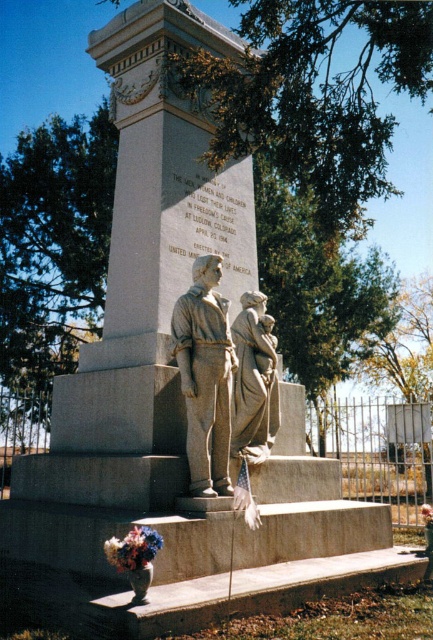
Question: Which point is farther from the camera taking this photo?

Choices:
 (A) (115, 550)
 (B) (426, 506)

Answer: (B)

Question: Considering the relative positions of matte gray stone sculpture at center and fluffy bouquet at lower center in the image provided, where is matte gray stone sculpture at center located with respect to fluffy bouquet at lower center?

Choices:
 (A) left
 (B) right

Answer: (A)

Question: Is matte gray stone sculpture at center to the left of fluffy bouquet at lower center from the viewer's perspective?

Choices:
 (A) no
 (B) yes

Answer: (B)

Question: Which of these objects is positioned farthest from the gray stone statue at center?

Choices:
 (A) matte gray stone sculpture at center
 (B) fluffy bouquet at lower center

Answer: (B)

Question: In this image, where is fluffy bouquet at lower left located relative to fluffy bouquet at lower center?

Choices:
 (A) right
 (B) left

Answer: (B)

Question: Which of the following is the closest to the observer?

Choices:
 (A) (216, 340)
 (B) (126, 554)
 (C) (261, 348)
 (D) (429, 520)

Answer: (B)